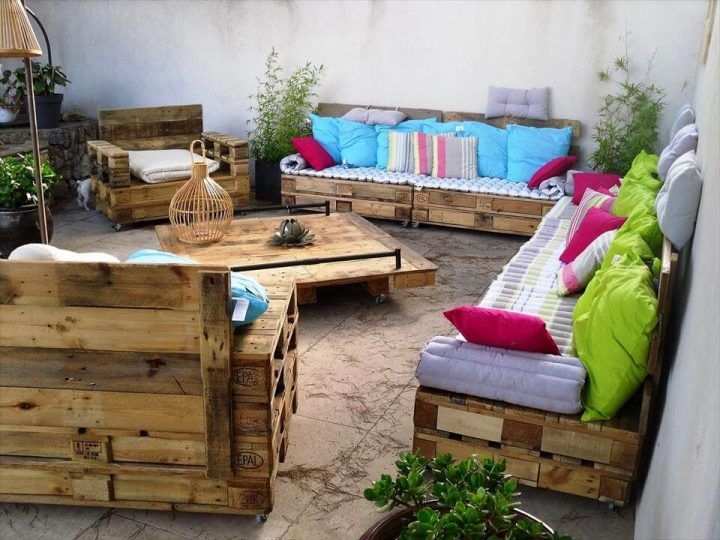
I want to click on coffee table, so click(x=363, y=238).